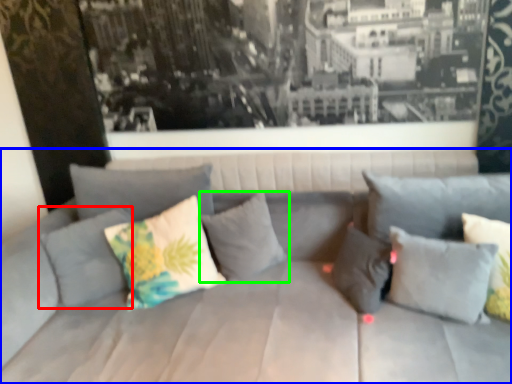
Question: Considering the real-world distances, which object is closest to pillow (highlighted by a red box)? studio couch (highlighted by a blue box) or pillow (highlighted by a green box).

Choices:
 (A) studio couch
 (B) pillow

Answer: (A)